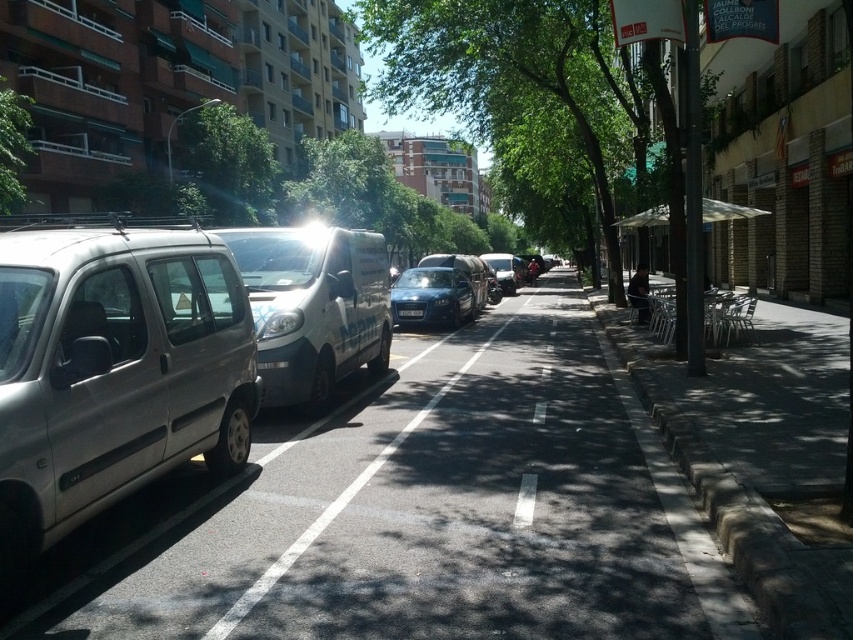
You are a pedestrian standing on the sidewalk and want to walk to the green leafy tree at center. There is a blue metallic license plate at center in your path. Which direction should you move to avoid the license plate and reach the tree?

Since the green leafy tree at center is to the right of the blue metallic license plate at center, you should move to the right side of the blue metallic license plate at center to reach the tree without obstruction.

You are a delivery driver trying to park your vehicle in the spot where the silver metallic van at left is currently parked. The parking spot is marked at coordinates 0.580, 0.135. Can you safely park your vehicle there if your van is 5.5 meters long?

The silver metallic van at left is already parked at the coordinates (114, 371), so the parking spot is occupied and you cannot park there.